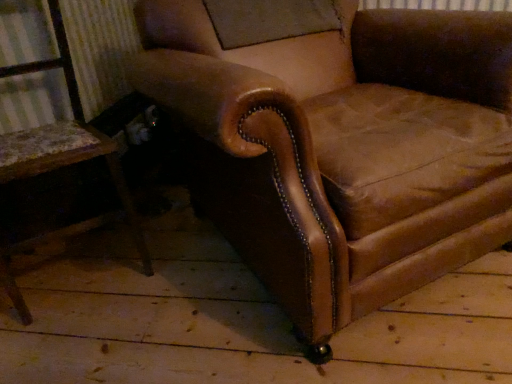
Where is `brown leather chair at left, the first chair when ordered from left to right`? The width and height of the screenshot is (512, 384). brown leather chair at left, the first chair when ordered from left to right is located at coordinates (64, 138).

The width and height of the screenshot is (512, 384). Describe the element at coordinates (64, 138) in the screenshot. I see `brown leather chair at left, the 2th chair when ordered from right to left` at that location.

What do you see at coordinates (338, 142) in the screenshot?
I see `brown leather armchair at center, the 2th chair in the left-to-right sequence` at bounding box center [338, 142].

I want to click on brown leather armchair at center, the 2th chair in the left-to-right sequence, so click(338, 142).

Where is `brown leather chair at left, the 2th chair when ordered from right to left`? brown leather chair at left, the 2th chair when ordered from right to left is located at coordinates (64, 138).

Visually, is brown leather armchair at center, acting as the 1th chair starting from the right, positioned to the left or to the right of brown leather chair at left, the first chair when ordered from left to right?

brown leather armchair at center, acting as the 1th chair starting from the right, is positioned on brown leather chair at left, the first chair when ordered from left to right,'s right side.

Is brown leather armchair at center, the 2th chair in the left-to-right sequence, further to camera compared to brown leather chair at left, the 2th chair when ordered from right to left?

No.

Considering the points (415, 27) and (64, 56), which point is in front, point (415, 27) or point (64, 56)?

Positioned in front is point (415, 27).

From the image's perspective, does brown leather armchair at center, the 2th chair in the left-to-right sequence, appear lower than brown leather chair at left, the 2th chair when ordered from right to left?

No, from the image's perspective, brown leather armchair at center, the 2th chair in the left-to-right sequence, is not below brown leather chair at left, the 2th chair when ordered from right to left.

From a real-world perspective, is brown leather armchair at center, the 2th chair in the left-to-right sequence, on brown leather chair at left, the first chair when ordered from left to right?

No, from a real-world perspective, brown leather armchair at center, the 2th chair in the left-to-right sequence, is not on top of brown leather chair at left, the first chair when ordered from left to right.

Which object is thinner, brown leather armchair at center, the 2th chair in the left-to-right sequence, or brown leather chair at left, the first chair when ordered from left to right?

With smaller width is brown leather chair at left, the first chair when ordered from left to right.

Considering the sizes of objects brown leather armchair at center, the 2th chair in the left-to-right sequence, and brown leather chair at left, the first chair when ordered from left to right, in the image provided, who is taller, brown leather armchair at center, the 2th chair in the left-to-right sequence, or brown leather chair at left, the first chair when ordered from left to right,?

Standing taller between the two is brown leather chair at left, the first chair when ordered from left to right.

Looking at the image, does brown leather armchair at center, the 2th chair in the left-to-right sequence, seem bigger or smaller compared to brown leather chair at left, the first chair when ordered from left to right?

Clearly, brown leather armchair at center, the 2th chair in the left-to-right sequence, is larger in size than brown leather chair at left, the first chair when ordered from left to right.

Choose the correct answer: Is brown leather armchair at center, the 2th chair in the left-to-right sequence, inside brown leather chair at left, the 2th chair when ordered from right to left, or outside it?

brown leather armchair at center, the 2th chair in the left-to-right sequence, is outside brown leather chair at left, the 2th chair when ordered from right to left.

Is brown leather armchair at center, the 2th chair in the left-to-right sequence, directly adjacent to brown leather chair at left, the first chair when ordered from left to right?

There is a gap between brown leather armchair at center, the 2th chair in the left-to-right sequence, and brown leather chair at left, the first chair when ordered from left to right.

Is brown leather armchair at center, acting as the 1th chair starting from the right, facing away from brown leather chair at left, the 2th chair when ordered from right to left?

No, brown leather armchair at center, acting as the 1th chair starting from the right, is not facing the opposite direction of brown leather chair at left, the 2th chair when ordered from right to left.

Identify the location of chair above the brown leather chair at left, the first chair when ordered from left to right (from the image's perspective). 338,142.

Which object is positioned more to the left, brown leather chair at left, the 2th chair when ordered from right to left, or brown leather armchair at center, acting as the 1th chair starting from the right?

brown leather chair at left, the 2th chair when ordered from right to left.

Which object is further away from the camera taking this photo, brown leather chair at left, the 2th chair when ordered from right to left, or brown leather armchair at center, the 2th chair in the left-to-right sequence?

brown leather chair at left, the 2th chair when ordered from right to left, is further from the camera.

Does point (9, 268) lie behind point (188, 164)?

No, it is not.

From the image's perspective, between brown leather chair at left, the 2th chair when ordered from right to left, and brown leather armchair at center, the 2th chair in the left-to-right sequence, which one is located above?

brown leather armchair at center, the 2th chair in the left-to-right sequence, appears higher in the image.

From a real-world perspective, who is located higher, brown leather chair at left, the first chair when ordered from left to right, or brown leather armchair at center, acting as the 1th chair starting from the right?

brown leather chair at left, the first chair when ordered from left to right, from a real-world perspective.

Does brown leather chair at left, the 2th chair when ordered from right to left, have a greater width compared to brown leather armchair at center, the 2th chair in the left-to-right sequence?

Incorrect, the width of brown leather chair at left, the 2th chair when ordered from right to left, does not surpass that of brown leather armchair at center, the 2th chair in the left-to-right sequence.

Which of these two, brown leather chair at left, the 2th chair when ordered from right to left, or brown leather armchair at center, the 2th chair in the left-to-right sequence, stands shorter?

brown leather armchair at center, the 2th chair in the left-to-right sequence.

Considering the relative sizes of brown leather chair at left, the 2th chair when ordered from right to left, and brown leather armchair at center, the 2th chair in the left-to-right sequence, in the image provided, is brown leather chair at left, the 2th chair when ordered from right to left, bigger than brown leather armchair at center, the 2th chair in the left-to-right sequence,?

Incorrect, brown leather chair at left, the 2th chair when ordered from right to left, is not larger than brown leather armchair at center, the 2th chair in the left-to-right sequence.

Which is correct: brown leather chair at left, the first chair when ordered from left to right, is inside brown leather armchair at center, the 2th chair in the left-to-right sequence, or outside of it?

brown leather chair at left, the first chair when ordered from left to right, is not enclosed by brown leather armchair at center, the 2th chair in the left-to-right sequence.

In the scene shown: Is brown leather chair at left, the 2th chair when ordered from right to left, in contact with brown leather armchair at center, the 2th chair in the left-to-right sequence?

brown leather chair at left, the 2th chair when ordered from right to left, is not next to brown leather armchair at center, the 2th chair in the left-to-right sequence, and they're not touching.

Could you tell me if brown leather chair at left, the first chair when ordered from left to right, is facing brown leather armchair at center, the 2th chair in the left-to-right sequence?

No, brown leather chair at left, the first chair when ordered from left to right, is not turned towards brown leather armchair at center, the 2th chair in the left-to-right sequence.

How many degrees apart are the facing directions of brown leather chair at left, the 2th chair when ordered from right to left, and brown leather armchair at center, the 2th chair in the left-to-right sequence?

The angular difference between brown leather chair at left, the 2th chair when ordered from right to left, and brown leather armchair at center, the 2th chair in the left-to-right sequence, is 5.04 degrees.

You are a GUI agent. You are given a task and a screenshot of the screen. Output one action in this format:
    pyautogui.click(x=<x>, y=<y>)
    Task: Click on the chair that is in front of the brown leather chair at left, the first chair when ordered from left to right
    The width and height of the screenshot is (512, 384).
    Given the screenshot: What is the action you would take?
    pos(338,142)

Where is `chair that is in front of the brown leather chair at left, the first chair when ordered from left to right`? This screenshot has height=384, width=512. chair that is in front of the brown leather chair at left, the first chair when ordered from left to right is located at coordinates (338, 142).

This screenshot has height=384, width=512. In order to click on chair on the right of brown leather chair at left, the first chair when ordered from left to right in this screenshot , I will do tap(338, 142).